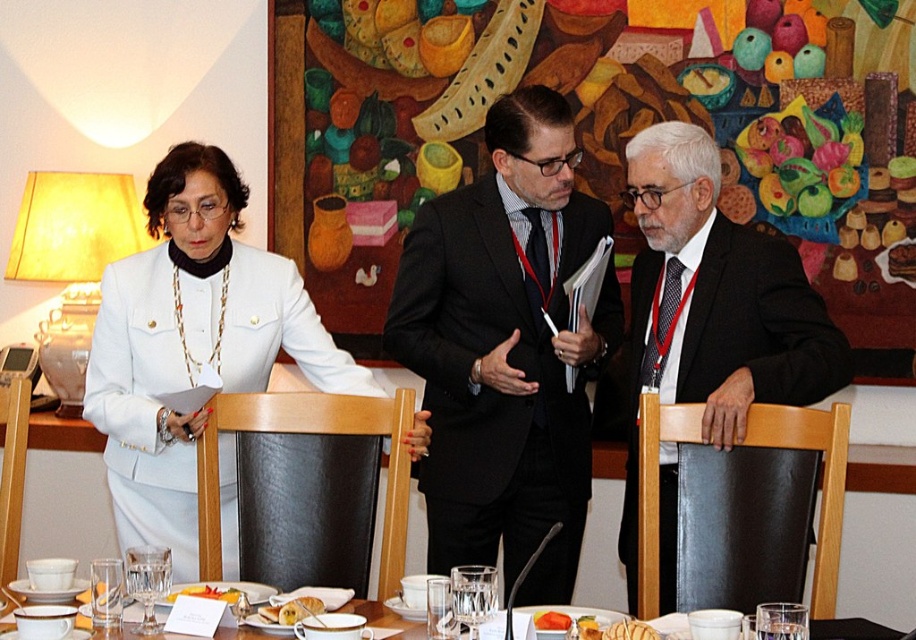
Question: Which object is the farthest from the black wool suit at center?

Choices:
 (A) yellow matte bread at center
 (B) golden bread at center
 (C) white matte jacket at center

Answer: (A)

Question: Considering the relative positions of white matte jacket at center and yellow matte bread at center in the image provided, where is white matte jacket at center located with respect to yellow matte bread at center?

Choices:
 (A) below
 (B) above

Answer: (B)

Question: Which object appears farthest from the camera in this image?

Choices:
 (A) orange matte carrot at center
 (B) white glossy table at center
 (C) white fabric coat at upper left
 (D) white matte jacket at center

Answer: (C)

Question: Among these points, which one is nearest to the camera?

Choices:
 (A) (833, 323)
 (B) (411, 624)
 (C) (536, 332)

Answer: (B)

Question: Is white matte jacket at center closer to camera compared to white glossy table at center?

Choices:
 (A) no
 (B) yes

Answer: (A)

Question: Observing the image, what is the correct spatial positioning of white fabric coat at upper left in reference to white matte jacket at center?

Choices:
 (A) left
 (B) right

Answer: (B)